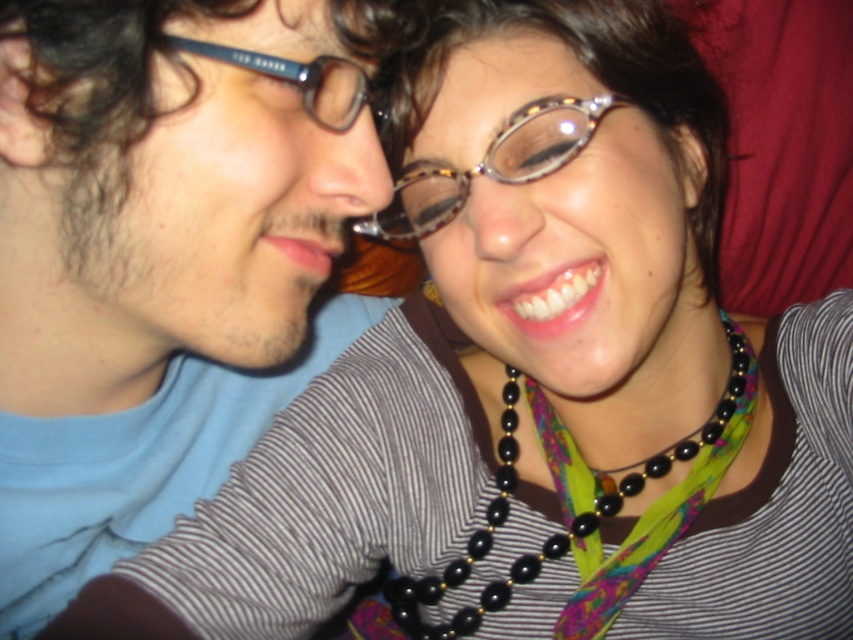
You are a optometrist examining two pairs of glasses in the image. The tortoiseshell acetate glasses at center and the matte blue plastic glasses at upper left. Which pair has a greater height?

The tortoiseshell acetate glasses at center is much taller as matte blue plastic glasses at upper left, so the tortoiseshell acetate glasses at center has a greater height.

You are a photographer adjusting your camera settings to focus on the black beaded necklace at center and the matte blue plastic glasses at upper left. Which object should you focus on first to ensure both are in sharp focus?

You should focus on the matte blue plastic glasses at upper left first because it is closer to the camera than the black beaded necklace at center, ensuring both will be in focus when starting from the closer object.

You are an interior designer observing the scene. You need to place a decorative item between the matte blue shirt at left and the black beaded necklace at center. Based on their positions, where should you place the item to ensure it is between them?

The matte blue shirt at left is above the black beaded necklace at center, so placing the decorative item in the middle between them would require positioning it below the matte blue shirt at left and above the black beaded necklace at center.